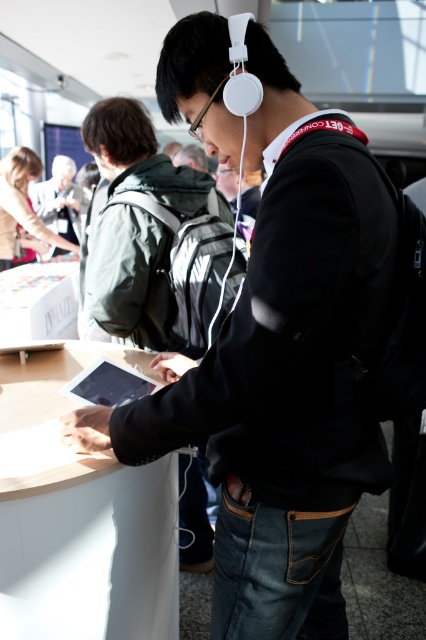
Which is more to the left, white matte table at center or matte black tablet at center?

white matte table at center

Image resolution: width=426 pixels, height=640 pixels. What do you see at coordinates (80, 516) in the screenshot?
I see `white matte table at center` at bounding box center [80, 516].

Which is behind, point (23, 524) or point (108, 401)?

The point (108, 401) is more distant.

Locate an element on the screen. The image size is (426, 640). white matte table at center is located at coordinates (80, 516).

Is white matte table at center closer to the viewer compared to matte black backpack at upper left?

Yes, it is.

Describe the element at coordinates (80, 516) in the screenshot. I see `white matte table at center` at that location.

Identify the location of white matte table at center. (80, 516).

Which is behind, point (57, 292) or point (109, 372)?

The point (57, 292) is more distant.

Which is behind, point (16, 288) or point (118, 385)?

The point (16, 288) is behind.

Locate an element on the screen. The width and height of the screenshot is (426, 640). white cardboard box at lower left is located at coordinates (39, 301).